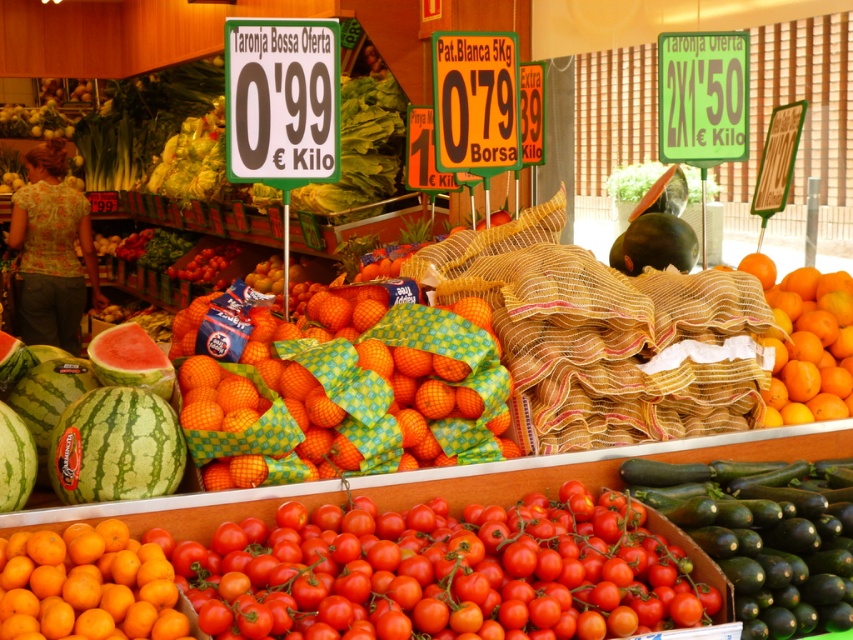
Question: Is orange matte at center smaller than green plastic sign at upper center?

Choices:
 (A) yes
 (B) no

Answer: (A)

Question: Is glossy red tomato at center bigger than green paper sign at upper right?

Choices:
 (A) yes
 (B) no

Answer: (A)

Question: Which is nearer to the orange plastic sign at center?

Choices:
 (A) green smooth zucchini at lower right
 (B) orangetextured nettingoranges at center
 (C) green striped watermelon at lower left
 (D) green plastic sign at upper center

Answer: (D)

Question: Which of the following is the farthest from the observer?

Choices:
 (A) (53, 616)
 (B) (676, 161)

Answer: (B)

Question: Estimate the real-world distances between objects in this image. Which object is farther from the green striped watermelon at lower left?

Choices:
 (A) watermelon at center
 (B) green paper sign at upper right

Answer: (B)

Question: Considering the relative positions of green smooth zucchini at lower right and green paper sign at upper right in the image provided, where is green smooth zucchini at lower right located with respect to green paper sign at upper right?

Choices:
 (A) above
 (B) below

Answer: (B)